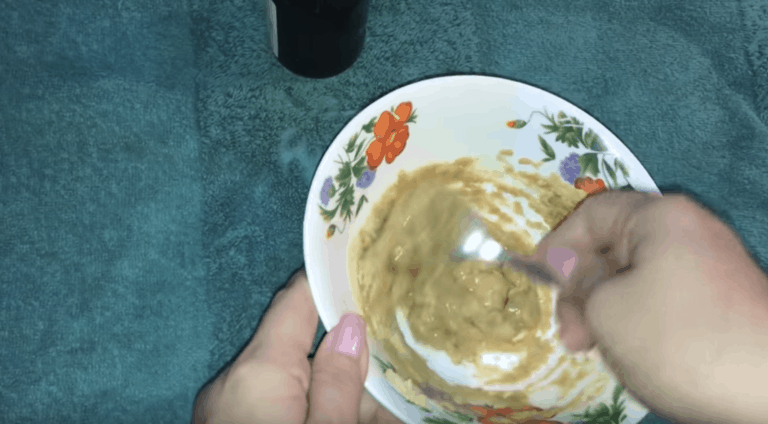
Locate an element on the screen. The width and height of the screenshot is (768, 424). blue towel is located at coordinates (154, 150).